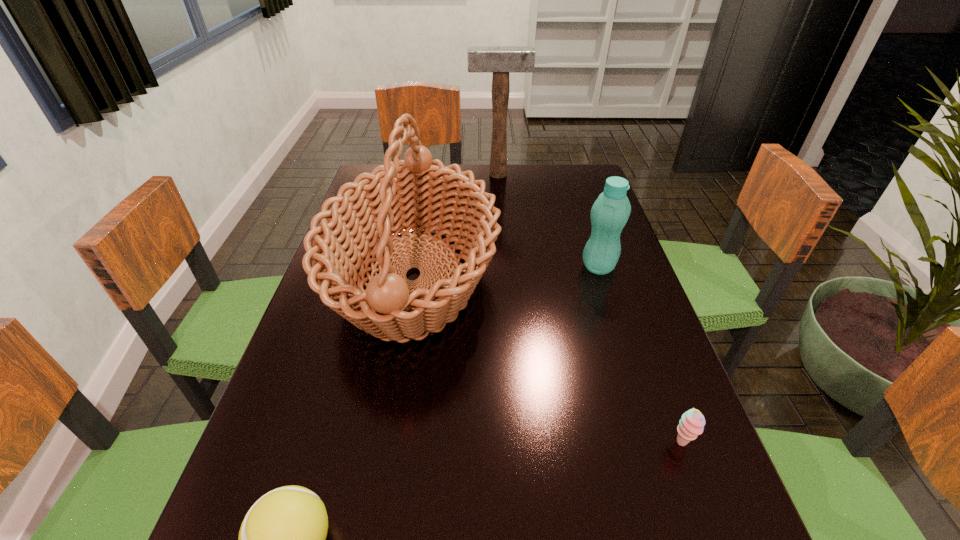
Locate an element on the screen. Image resolution: width=960 pixels, height=540 pixels. object at the left edge is located at coordinates (392, 199).

Where is `bottle positioned at the right edge`? The image size is (960, 540). bottle positioned at the right edge is located at coordinates (610, 212).

This screenshot has height=540, width=960. I want to click on sherbert located in the right edge section of the desktop, so click(692, 422).

Where is `vacant space at the far edge of the desktop`? The image size is (960, 540). vacant space at the far edge of the desktop is located at coordinates (540, 171).

Image resolution: width=960 pixels, height=540 pixels. I want to click on free space at the left edge, so click(x=343, y=458).

The width and height of the screenshot is (960, 540). Find the location of `free location at the right edge`. free location at the right edge is located at coordinates (612, 277).

Identify the location of blank space at the far right corner of the desktop. (551, 186).

Where is `vacant region between the mallet and the third shortest object`? vacant region between the mallet and the third shortest object is located at coordinates (548, 220).

This screenshot has height=540, width=960. I want to click on free space between the mallet and the shortest object, so click(589, 309).

The width and height of the screenshot is (960, 540). What are the coordinates of `vacant space that's between the shortest object and the bottle` in the screenshot? It's located at (640, 355).